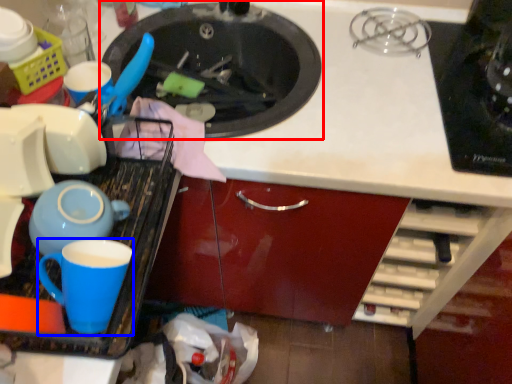
Question: Which of the following is the closest to the observer, sink (highlighted by a red box) or coffee cup (highlighted by a blue box)?

Choices:
 (A) sink
 (B) coffee cup

Answer: (B)